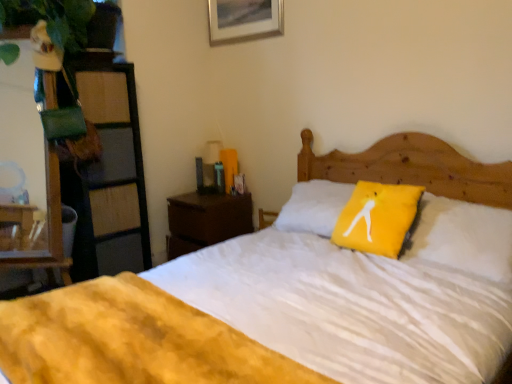
You are a GUI agent. You are given a task and a screenshot of the screen. Output one action in this format:
    pyautogui.click(x=<x>, y=<y>)
    Task: Click on the blank space situated above brown wood nightstand at center (from a real-world perspective)
    The width and height of the screenshot is (512, 384).
    Given the screenshot: What is the action you would take?
    pyautogui.click(x=211, y=195)